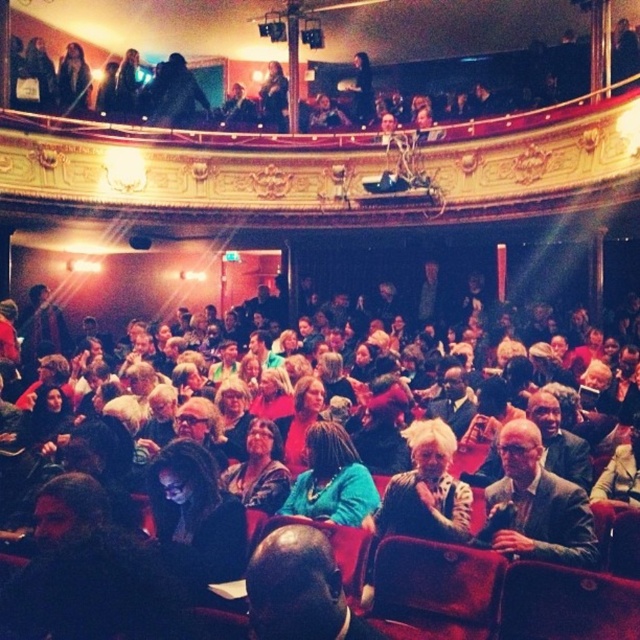
Question: From the image, what is the correct spatial relationship of teal fabric dress at center in relation to dark brown leather jacket at center?

Choices:
 (A) left
 (B) right

Answer: (B)

Question: Which point is farther from the camera taking this photo?

Choices:
 (A) (289, 484)
 (B) (346, 456)

Answer: (A)

Question: Is teal fabric dress at center wider than dark brown leather jacket at center?

Choices:
 (A) yes
 (B) no

Answer: (A)

Question: Does teal fabric dress at center have a greater width compared to dark brown leather jacket at center?

Choices:
 (A) no
 (B) yes

Answer: (B)

Question: Which point appears farthest from the camera in this image?

Choices:
 (A) (349, 496)
 (B) (272, 458)

Answer: (B)